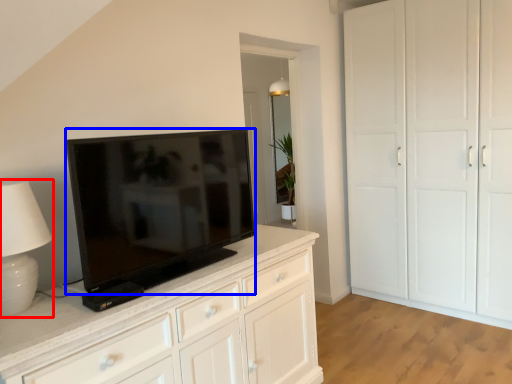
Question: Which object is closer to the camera taking this photo, table lamp (highlighted by a red box) or television (highlighted by a blue box)?

Choices:
 (A) table lamp
 (B) television

Answer: (A)